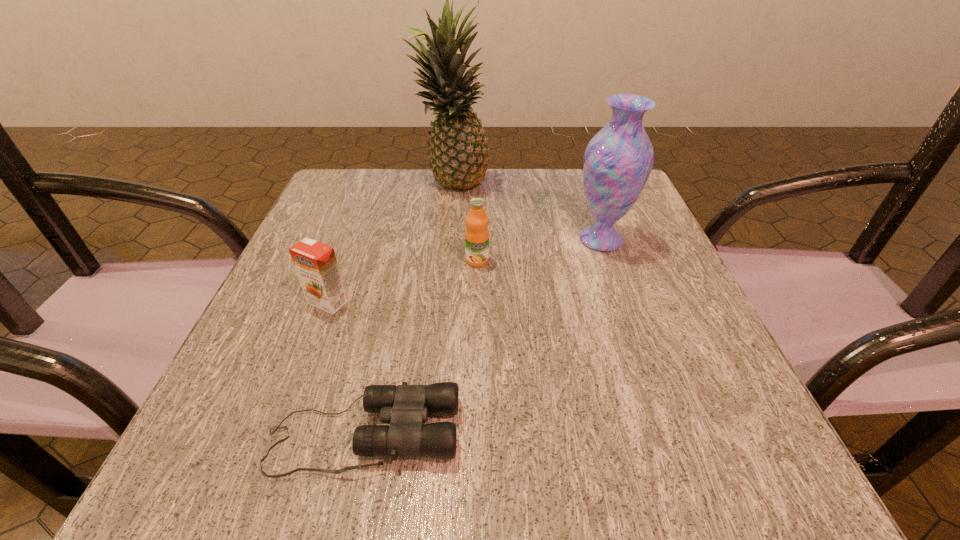
Where is `vacant space located 0.400m on the left of the fourth shortest object`? This screenshot has width=960, height=540. vacant space located 0.400m on the left of the fourth shortest object is located at coordinates (378, 240).

I want to click on vacant space located 0.290m on the label of the farther orange juice, so click(476, 399).

This screenshot has height=540, width=960. In order to click on free space located on the back of the second nearest object in this screenshot , I will do `click(362, 210)`.

This screenshot has height=540, width=960. What are the coordinates of `vacant space situated at the eyepiece of the shortest object` in the screenshot? It's located at click(x=631, y=434).

The height and width of the screenshot is (540, 960). In order to click on object that is at the far edge in this screenshot , I will do `click(459, 158)`.

Find the location of a particular element. The image size is (960, 540). object that is at the near edge is located at coordinates (406, 407).

At what (x,y) coordinates should I click in order to perform the action: click on orange juice positioned at the left edge. Please return your answer as a coordinate pair (x, y). The width and height of the screenshot is (960, 540). Looking at the image, I should click on (315, 262).

Locate an element on the screen. This screenshot has height=540, width=960. binoculars that is at the left edge is located at coordinates (406, 407).

The height and width of the screenshot is (540, 960). Identify the location of object present at the right edge. (618, 160).

Find the location of a particular element. The height and width of the screenshot is (540, 960). object located in the near left corner section of the desktop is located at coordinates (406, 407).